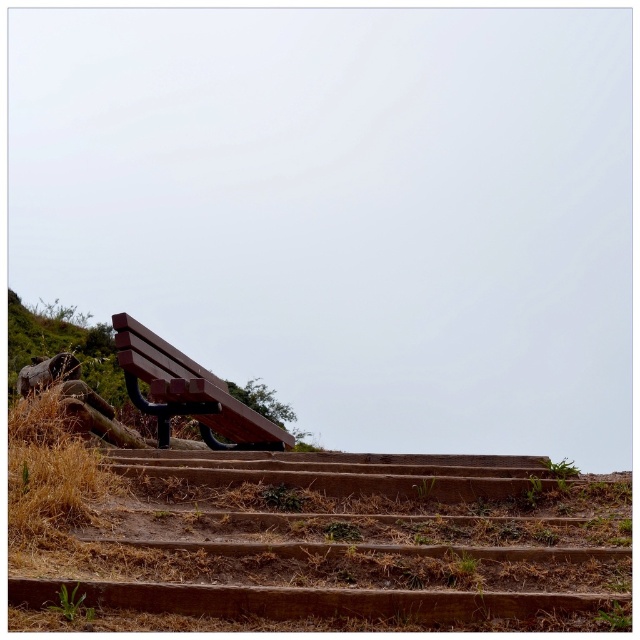
Question: Which of the following is the closest to the observer?

Choices:
 (A) (625, 586)
 (B) (209, 394)

Answer: (A)

Question: Which point appears farthest from the camera in this image?

Choices:
 (A) (132, 342)
 (B) (109, 460)

Answer: (A)

Question: Which object appears farthest from the camera in this image?

Choices:
 (A) wooden bench at center
 (B) brown wooden stairs at lower center

Answer: (A)

Question: Is brown wooden stairs at lower center closer to the viewer compared to wooden bench at center?

Choices:
 (A) yes
 (B) no

Answer: (A)

Question: Is brown wooden stairs at lower center above wooden bench at center?

Choices:
 (A) yes
 (B) no

Answer: (B)

Question: Is brown wooden stairs at lower center wider than wooden bench at center?

Choices:
 (A) no
 (B) yes

Answer: (B)